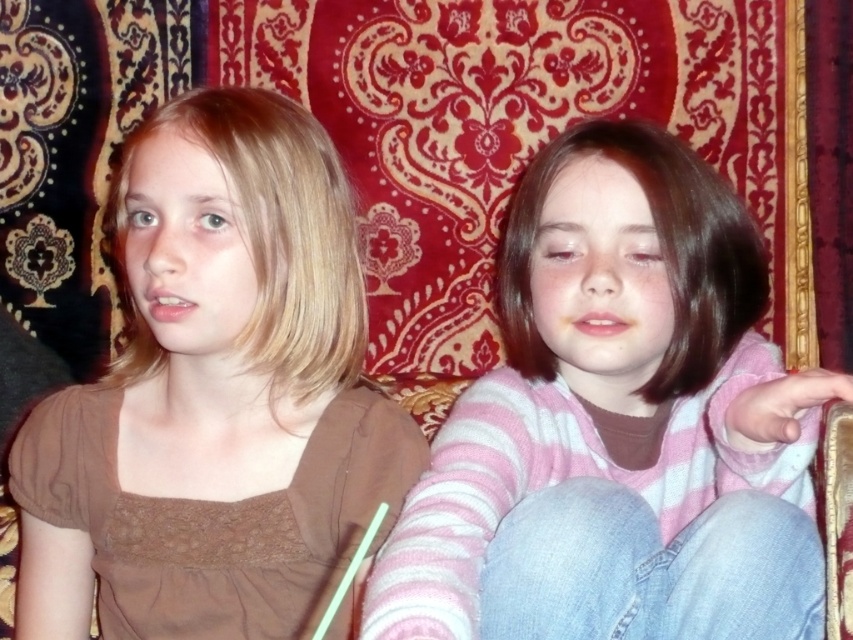
Question: Does pink striped sweater at center come in front of brown matte shirt at left?

Choices:
 (A) no
 (B) yes

Answer: (B)

Question: Is pink striped sweater at center further to camera compared to brown matte shirt at left?

Choices:
 (A) yes
 (B) no

Answer: (B)

Question: Which object appears closest to the camera in this image?

Choices:
 (A) pink striped sweater at center
 (B) brown matte shirt at left

Answer: (A)

Question: Is the position of pink striped sweater at center more distant than that of brown matte shirt at left?

Choices:
 (A) yes
 (B) no

Answer: (B)